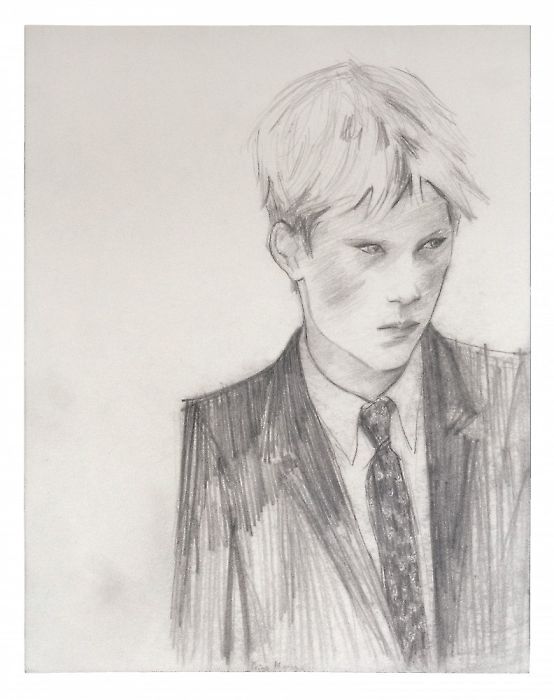
Identify the location of picture. The image size is (554, 700). (369, 129).